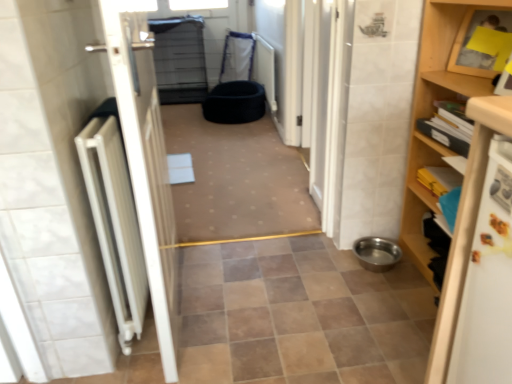
Question: From the image's perspective, is black fabric pet bed at center, the first toilet bowl positioned from the back, located beneath wooden shelf at right?

Choices:
 (A) no
 (B) yes

Answer: (A)

Question: From a real-world perspective, is black fabric pet bed at center, the 2th toilet bowl positioned from the right, located higher than wooden shelf at right?

Choices:
 (A) yes
 (B) no

Answer: (B)

Question: Is black fabric pet bed at center, the 2th toilet bowl positioned from the right, at the left side of wooden shelf at right?

Choices:
 (A) yes
 (B) no

Answer: (A)

Question: Does black fabric pet bed at center, the 2th toilet bowl in the front-to-back sequence, touch wooden shelf at right?

Choices:
 (A) no
 (B) yes

Answer: (A)

Question: Considering the relative positions of black fabric pet bed at center, positioned as the first toilet bowl in left-to-right order, and wooden shelf at right in the image provided, is black fabric pet bed at center, positioned as the first toilet bowl in left-to-right order, behind wooden shelf at right?

Choices:
 (A) yes
 (B) no

Answer: (A)

Question: From their relative heights in the image, would you say wooden shelf at right is taller or shorter than metallic stainless steel bowl at lower right, arranged as the first toilet bowl when ordered from the bottom?

Choices:
 (A) short
 (B) tall

Answer: (B)

Question: Looking at their shapes, would you say wooden shelf at right is wider or thinner than metallic stainless steel bowl at lower right, which is the 2th toilet bowl from left to right?

Choices:
 (A) thin
 (B) wide

Answer: (B)

Question: Relative to metallic stainless steel bowl at lower right, arranged as the first toilet bowl when ordered from the bottom, is wooden shelf at right in front or behind?

Choices:
 (A) front
 (B) behind

Answer: (A)

Question: From the image's perspective, is wooden shelf at right located above or below metallic stainless steel bowl at lower right, which is the 1th toilet bowl from right to left?

Choices:
 (A) above
 (B) below

Answer: (A)

Question: From the image's perspective, relative to black fabric pet bed at center, is black fabric pet bed at center, which appears as the 1th toilet bowl when viewed from the top, above or below?

Choices:
 (A) above
 (B) below

Answer: (A)

Question: Is black fabric pet bed at center, positioned as the first toilet bowl in left-to-right order, in front of or behind black fabric pet bed at center in the image?

Choices:
 (A) behind
 (B) front

Answer: (A)

Question: Considering the positions of point click(212, 100) and point click(169, 150), is point click(212, 100) closer or farther from the camera than point click(169, 150)?

Choices:
 (A) farther
 (B) closer

Answer: (A)

Question: Which is correct: black fabric pet bed at center, which is counted as the second toilet bowl, starting from the bottom, is inside black fabric pet bed at center, or outside of it?

Choices:
 (A) inside
 (B) outside

Answer: (B)

Question: Is black fabric pet bed at center, which is counted as the second toilet bowl, starting from the bottom, to the left or to the right of metallic stainless steel bowl at lower right, arranged as the first toilet bowl when ordered from the bottom, in the image?

Choices:
 (A) right
 (B) left

Answer: (B)

Question: Is black fabric pet bed at center, which is counted as the second toilet bowl, starting from the bottom, inside or outside of metallic stainless steel bowl at lower right, the first toilet bowl in the front-to-back sequence?

Choices:
 (A) outside
 (B) inside

Answer: (A)